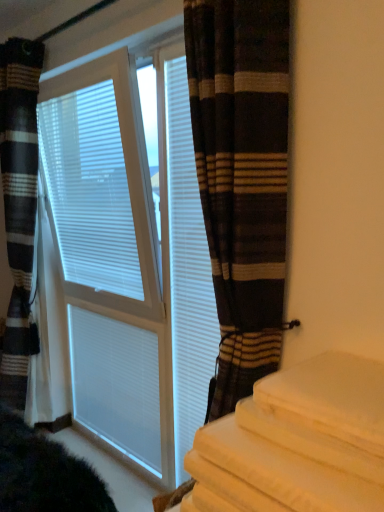
Question: Considering the positions of striped fabric curtain at left, the first curtain viewed from the back, and white textured blinds at center in the image, is striped fabric curtain at left, the first curtain viewed from the back, taller or shorter than white textured blinds at center?

Choices:
 (A) tall
 (B) short

Answer: (A)

Question: Would you say striped fabric curtain at left, which appears as the 2th curtain when viewed from the front, is to the left or to the right of white textured blinds at center in the picture?

Choices:
 (A) left
 (B) right

Answer: (A)

Question: Which of these objects is positioned closest to the white matte shutter at center, which appears as the 2th shutter when viewed from the left?

Choices:
 (A) white matte shutter at center, which is the first shutter in back-to-front order
 (B) white cotton bedding at lower right
 (C) white textured blinds at center
 (D) striped fabric curtain at left, which appears as the 2th curtain when viewed from the front
 (E) brown striped curtain at center, which is counted as the 2th curtain, starting from the left

Answer: (C)

Question: Which object is positioned farthest from the white matte blinds at center?

Choices:
 (A) white textured blinds at center
 (B) brown striped curtain at center, the first curtain in the front-to-back sequence
 (C) white matte shutter at center, which is the first shutter in back-to-front order
 (D) white cotton bedding at lower right
 (E) white matte shutter at center, which ranks as the second shutter in back-to-front order

Answer: (D)